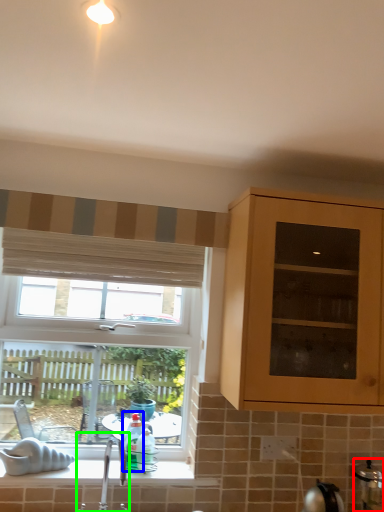
Question: Which object is positioned closest to appliance (highlighted by a red box)? Select from bottle (highlighted by a blue box) and tap (highlighted by a green box).

Choices:
 (A) bottle
 (B) tap

Answer: (A)